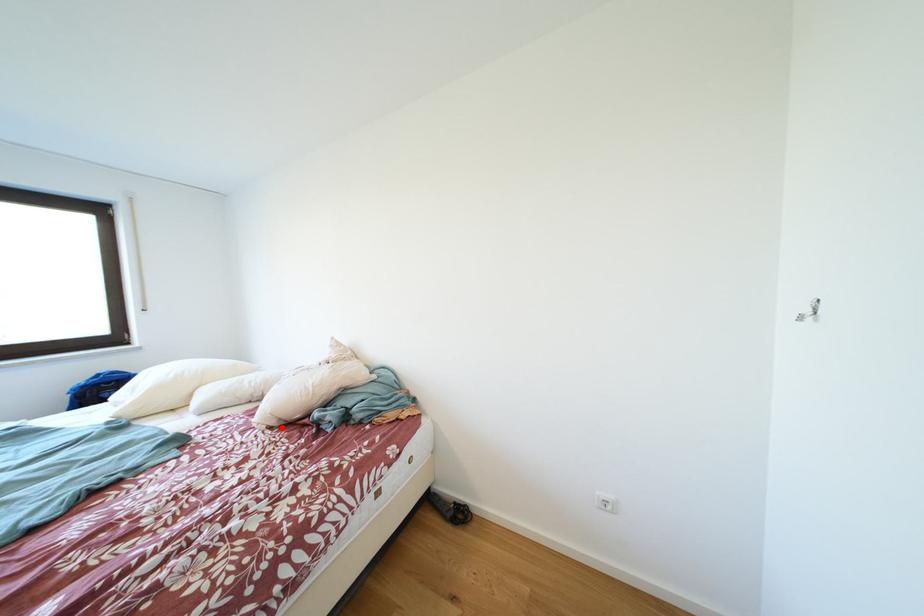
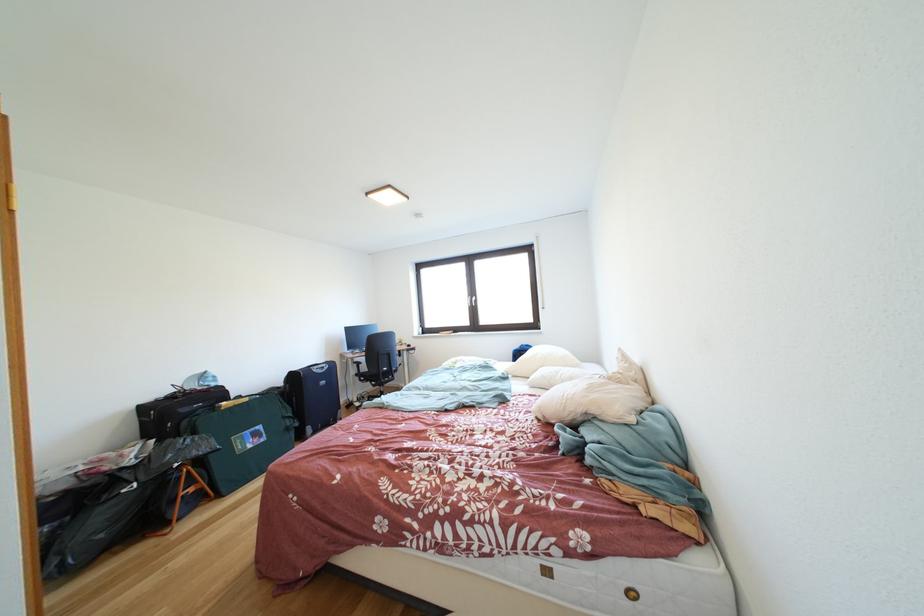
Question: I am providing you with two images of the same scene from different viewpoints. A red point is marked on the first image. Can you still see the location of the red point in image 2?

Choices:
 (A) Yes
 (B) No

Answer: (A)